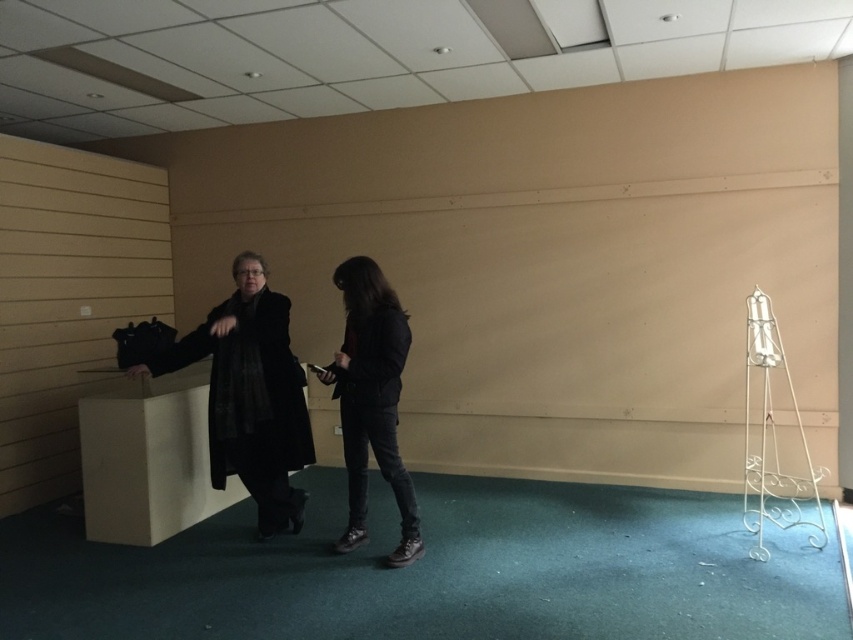
Question: Which point is closer to the camera?

Choices:
 (A) matte black coat at left
 (B) matte black jacket at center

Answer: (B)

Question: Among these objects, which one is farthest from the camera?

Choices:
 (A) matte black jacket at center
 (B) matte black coat at left

Answer: (B)

Question: Can you confirm if matte black coat at left is smaller than matte black jacket at center?

Choices:
 (A) yes
 (B) no

Answer: (B)

Question: Is matte black coat at left below matte black jacket at center?

Choices:
 (A) no
 (B) yes

Answer: (B)

Question: Can you confirm if matte black coat at left is positioned below matte black jacket at center?

Choices:
 (A) no
 (B) yes

Answer: (B)